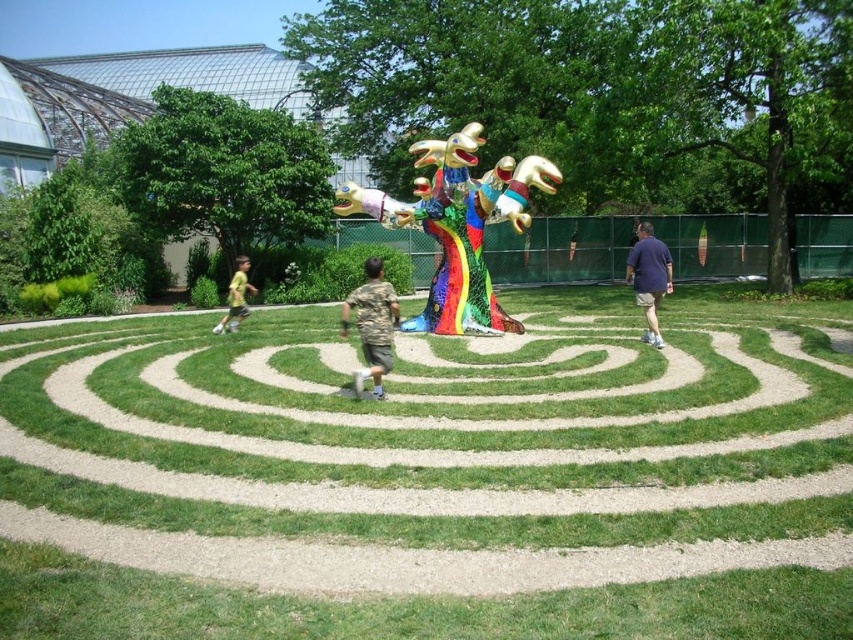
Question: Can you confirm if camouflage fabric shirt at center is positioned above dark blue shirt at right?

Choices:
 (A) no
 (B) yes

Answer: (A)

Question: Is the position of dark blue shirt at right less distant than that of yellow cotton shirt at left?

Choices:
 (A) no
 (B) yes

Answer: (B)

Question: Which object is farther from the camera taking this photo?

Choices:
 (A) dark blue shirt at right
 (B) yellow cotton shirt at left
 (C) camouflage fabric shirt at center

Answer: (B)

Question: Is camouflage fabric shirt at center smaller than yellow cotton shirt at left?

Choices:
 (A) no
 (B) yes

Answer: (B)

Question: Based on their relative distances, which object is farther from the camouflage fabric shirt at center?

Choices:
 (A) dark blue shirt at right
 (B) yellow cotton shirt at left

Answer: (A)

Question: Estimate the real-world distances between objects in this image. Which object is closer to the yellow cotton shirt at left?

Choices:
 (A) camouflage fabric shirt at center
 (B) dark blue shirt at right

Answer: (A)